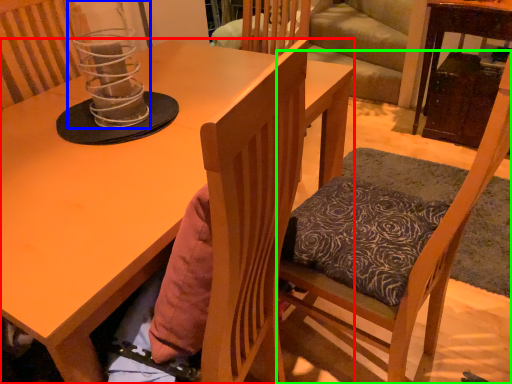
Question: Considering the real-world distances, which object is closest to desk (highlighted by a red box)? candle holder (highlighted by a blue box) or chair (highlighted by a green box).

Choices:
 (A) candle holder
 (B) chair

Answer: (A)